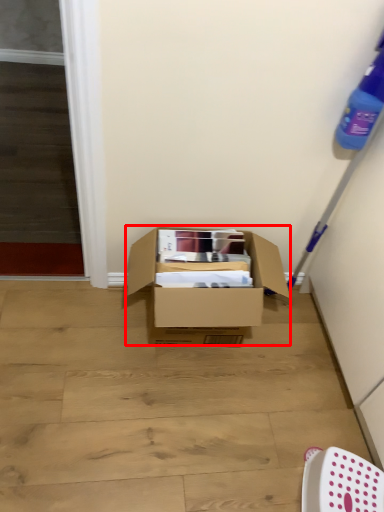
Question: Where is box (annotated by the red box) located in relation to chair in the image?

Choices:
 (A) right
 (B) left

Answer: (B)